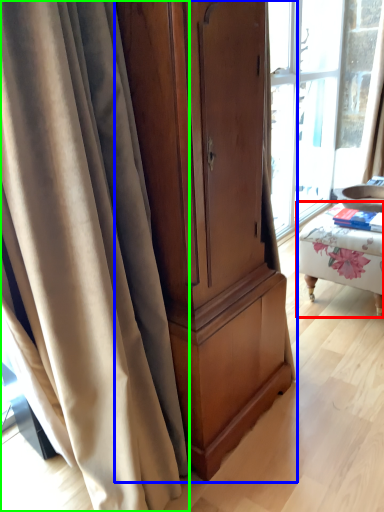
Question: Estimate the real-world distances between objects in this image. Which object is closer to furniture (highlighted by a red box), cabinetry (highlighted by a blue box) or curtain (highlighted by a green box)?

Choices:
 (A) cabinetry
 (B) curtain

Answer: (A)